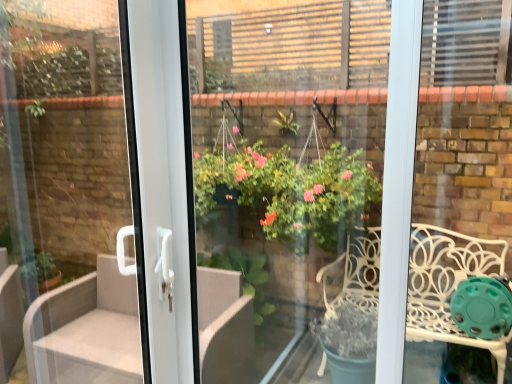
Where is `transparent glass window screen at center`? The width and height of the screenshot is (512, 384). transparent glass window screen at center is located at coordinates (286, 193).

Describe the element at coordinates (286, 193) in the screenshot. This screenshot has height=384, width=512. I see `transparent glass window screen at center` at that location.

Where is `transparent glass window screen at center`? The image size is (512, 384). transparent glass window screen at center is located at coordinates (286, 193).